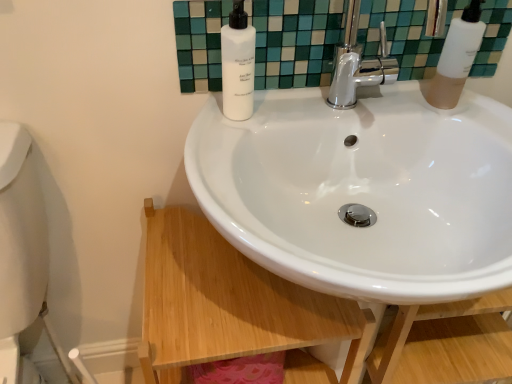
Question: Could you tell me if white matte bottle at upper center, the first soap dispenser when ordered from left to right, is turned towards white glossy mirror at upper center?

Choices:
 (A) yes
 (B) no

Answer: (B)

Question: Can white glossy mirror at upper center be found inside white matte bottle at upper center, the first soap dispenser when ordered from left to right?

Choices:
 (A) yes
 (B) no

Answer: (B)

Question: Is the depth of white matte bottle at upper center, the first soap dispenser when ordered from left to right, greater than that of white glossy mirror at upper center?

Choices:
 (A) yes
 (B) no

Answer: (B)

Question: Is the depth of white matte bottle at upper center, the first soap dispenser when ordered from left to right, less than that of white glossy mirror at upper center?

Choices:
 (A) yes
 (B) no

Answer: (A)

Question: Is white glossy mirror at upper center at the back of white matte bottle at upper center, which ranks as the second soap dispenser in right-to-left order?

Choices:
 (A) no
 (B) yes

Answer: (B)

Question: Is white matte bottle at upper center, which ranks as the second soap dispenser in right-to-left order, wider or thinner than white matte bottle at upper right, arranged as the 2th soap dispenser when viewed from the left?

Choices:
 (A) wide
 (B) thin

Answer: (B)

Question: From a real-world perspective, is white matte bottle at upper center, which ranks as the second soap dispenser in right-to-left order, positioned above or below white matte bottle at upper right, arranged as the 2th soap dispenser when viewed from the left?

Choices:
 (A) below
 (B) above

Answer: (A)

Question: Is white matte bottle at upper center, the first soap dispenser when ordered from left to right, inside or outside of white matte bottle at upper right, acting as the first soap dispenser starting from the right?

Choices:
 (A) outside
 (B) inside

Answer: (A)

Question: In terms of size, does white matte bottle at upper center, the first soap dispenser when ordered from left to right, appear bigger or smaller than white matte bottle at upper right, acting as the first soap dispenser starting from the right?

Choices:
 (A) small
 (B) big

Answer: (A)

Question: Considering the positions of point (470, 6) and point (230, 61), is point (470, 6) closer or farther from the camera than point (230, 61)?

Choices:
 (A) closer
 (B) farther

Answer: (B)

Question: Based on their sizes in the image, would you say white matte bottle at upper right, acting as the first soap dispenser starting from the right, is bigger or smaller than white matte bottle at upper center, which ranks as the second soap dispenser in right-to-left order?

Choices:
 (A) small
 (B) big

Answer: (B)

Question: From the image's perspective, is white matte bottle at upper right, arranged as the 2th soap dispenser when viewed from the left, located above or below white matte bottle at upper center, the first soap dispenser when ordered from left to right?

Choices:
 (A) below
 (B) above

Answer: (B)

Question: From a real-world perspective, relative to white matte bottle at upper center, the first soap dispenser when ordered from left to right, is white matte bottle at upper right, acting as the first soap dispenser starting from the right, vertically above or below?

Choices:
 (A) above
 (B) below

Answer: (A)

Question: Does point (471, 178) appear closer or farther from the camera than point (245, 62)?

Choices:
 (A) farther
 (B) closer

Answer: (A)

Question: Is white glossy sink at center spatially inside white matte bottle at upper center, the first soap dispenser when ordered from left to right, or outside of it?

Choices:
 (A) inside
 (B) outside

Answer: (B)